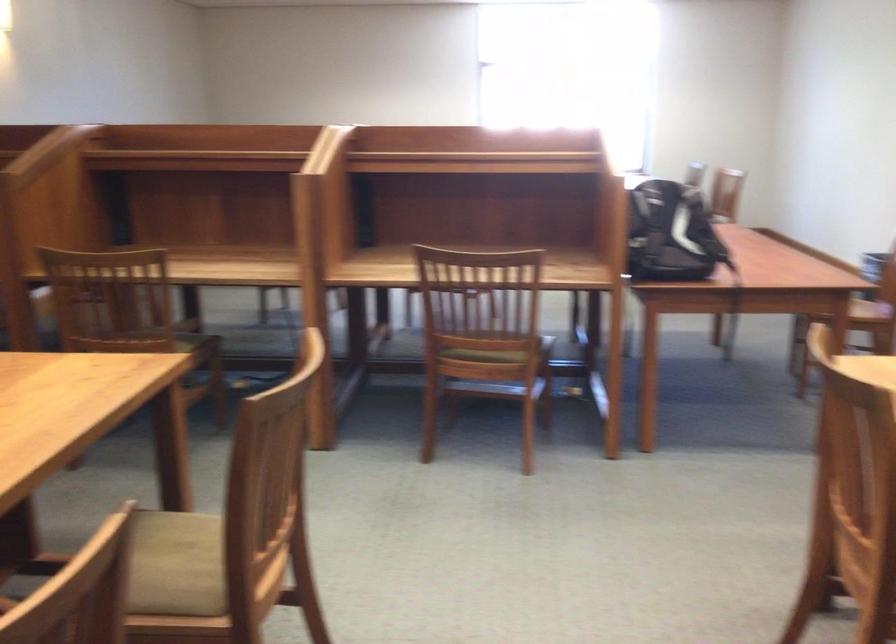
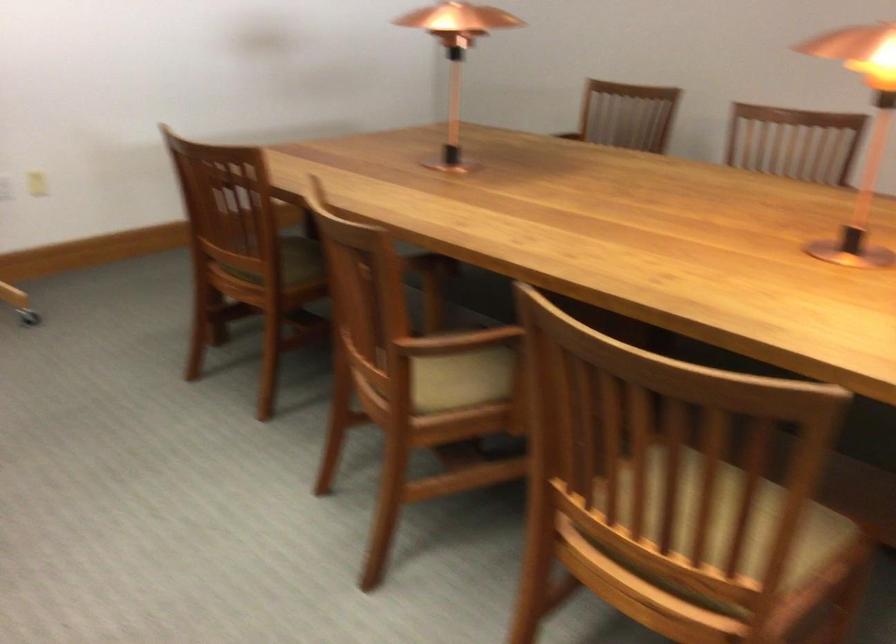
Where in the second image is the point corresponding to point 288,462 from the first image?

(728, 526)